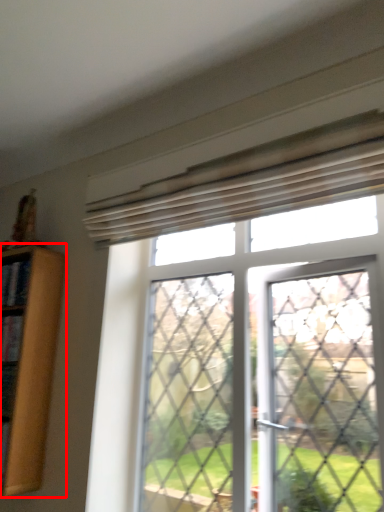
Question: From the image's perspective, what is the correct spatial positioning of shelf (annotated by the red box) in reference to window?

Choices:
 (A) above
 (B) below

Answer: (B)